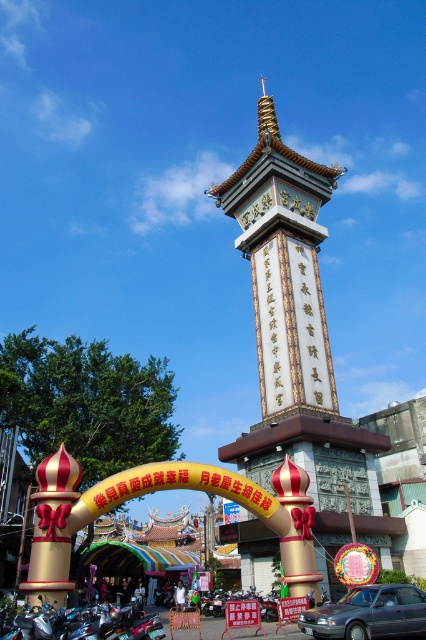
You are a tourist standing in front of the monument and want to take a photo that includes both the white stone tower at center and the metallic gray sedan at lower right. Based on their positions, which object should you place on the left side of your photo to capture both properly?

The white stone tower at center is positioned on the left side of metallic gray sedan at lower right, so to capture both properly, you should place the white stone tower at center on the left side of your photo.

You are a tourist standing in front of the monument and want to take a photo that includes both the white stone tower at center and the metallic gray sedan at lower right. Which object should you position closer to the camera to ensure both are in the frame?

To include both the white stone tower at center and the metallic gray sedan at lower right in the photo, you should position the metallic gray sedan at lower right closer to the camera since the white stone tower at center is above it, meaning it is farther away.